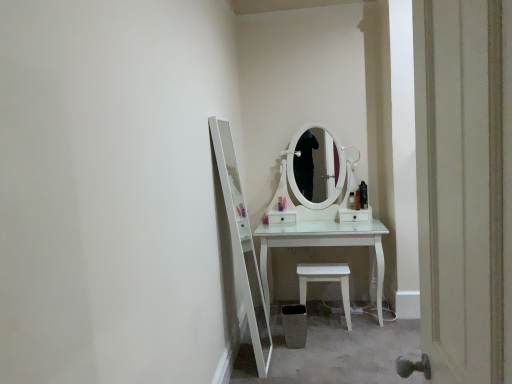
Question: Which direction should I rotate to face translucent plastic bottle at center, the second toiletry from the left, — up or down?

Choices:
 (A) up
 (B) down

Answer: (B)

Question: Considering the relative sizes of white wooden door at right and white plastic stool at lower center in the image provided, is white wooden door at right wider than white plastic stool at lower center?

Choices:
 (A) no
 (B) yes

Answer: (A)

Question: Is white plastic stool at lower center a part of white wooden door at right?

Choices:
 (A) yes
 (B) no

Answer: (B)

Question: From a real-world perspective, is white wooden door at right over white plastic stool at lower center?

Choices:
 (A) yes
 (B) no

Answer: (A)

Question: Is white wooden door at right next to white plastic stool at lower center?

Choices:
 (A) no
 (B) yes

Answer: (A)

Question: From the image's perspective, is white wooden door at right located beneath white plastic stool at lower center?

Choices:
 (A) no
 (B) yes

Answer: (A)

Question: Is white wooden door at right positioned in front of white plastic stool at lower center?

Choices:
 (A) no
 (B) yes

Answer: (B)

Question: Is white wooden door at right far away from matte orange bottle at center, the 2th toiletry viewed from the right?

Choices:
 (A) no
 (B) yes

Answer: (B)

Question: From a real-world perspective, is white wooden door at right below matte orange bottle at center, the 2th toiletry viewed from the right?

Choices:
 (A) yes
 (B) no

Answer: (B)

Question: Considering the relative sizes of white wooden door at right and matte orange bottle at center, the 2th toiletry viewed from the right, in the image provided, is white wooden door at right wider than matte orange bottle at center, the 2th toiletry viewed from the right,?

Choices:
 (A) no
 (B) yes

Answer: (B)

Question: Is matte orange bottle at center, the 2th toiletry viewed from the right, surrounded by white wooden door at right?

Choices:
 (A) yes
 (B) no

Answer: (B)

Question: Is white wooden door at right thinner than matte orange bottle at center, which is the 4th toiletry from left to right?

Choices:
 (A) no
 (B) yes

Answer: (A)

Question: Is white wooden door at right behind matte orange bottle at center, the 2th toiletry viewed from the right?

Choices:
 (A) yes
 (B) no

Answer: (B)

Question: Is translucent plastic bottle at center, the second toiletry from the left, not near white plastic stool at lower center?

Choices:
 (A) yes
 (B) no

Answer: (B)